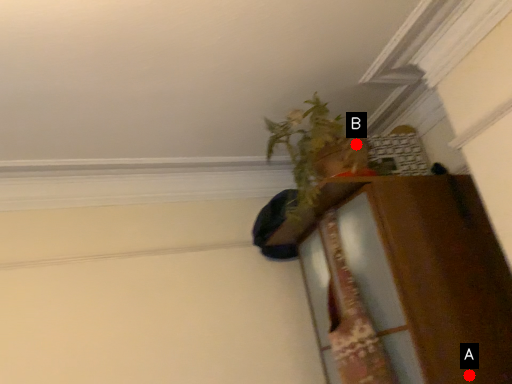
Question: Two points are circled on the image, labeled by A and B beside each circle. Which point is closer to the camera taking this photo?

Choices:
 (A) A is closer
 (B) B is closer

Answer: (A)